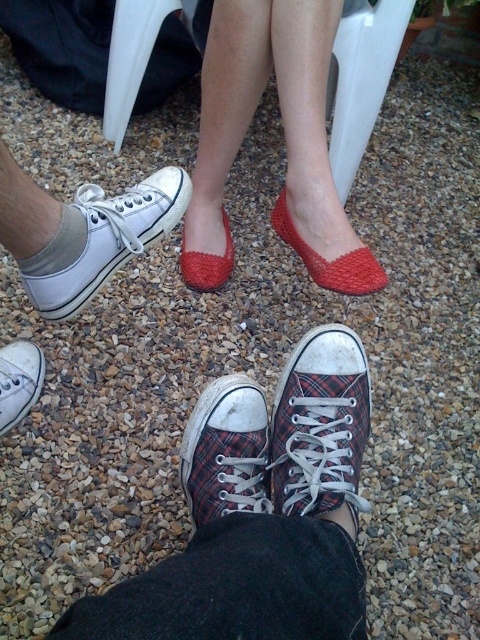
You are standing on the gravel surface and see the red knitted flats at center and the white canvas sneaker at lower left. Which footwear is located to the right of the other?

The red knitted flats at center is positioned on the right side of white canvas sneaker at lower left.

You are standing on the gravel surface and want to pick up the red knitted flats at center and the red knitted slipper at center. Which one is higher up so you can reach it first?

The red knitted flats at center is taller than the red knitted slipper at center, so you can reach the red knitted flats at center first.